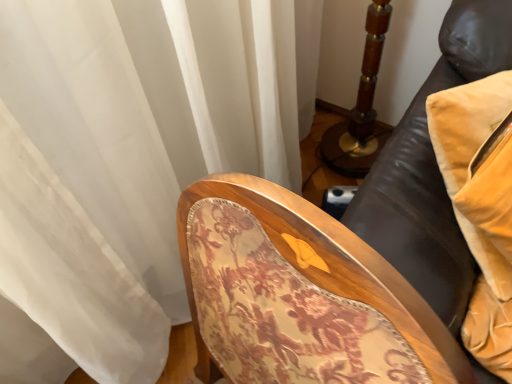
The image size is (512, 384). Describe the element at coordinates (466, 123) in the screenshot. I see `velvet yellow pillow at right` at that location.

You are a GUI agent. You are given a task and a screenshot of the screen. Output one action in this format:
    pyautogui.click(x=<x>, y=<y>)
    Task: Click on the velvet yellow pillow at right
    The image size is (512, 384).
    Given the screenshot: What is the action you would take?
    466,123

Identify the location of floral fabric chair at center. The width and height of the screenshot is (512, 384). (432, 170).

What do you see at coordinates (432, 170) in the screenshot? I see `floral fabric chair at center` at bounding box center [432, 170].

The width and height of the screenshot is (512, 384). Find the location of `velvet yellow pillow at right`. velvet yellow pillow at right is located at coordinates (466, 123).

Which is more to the right, floral fabric chair at center or velvet yellow pillow at right?

velvet yellow pillow at right.

Does floral fabric chair at center lie behind velvet yellow pillow at right?

No, it is in front of velvet yellow pillow at right.

Which is farther, (477,56) or (467,179)?

The point (477,56) is farther.

From the image's perspective, is floral fabric chair at center on top of velvet yellow pillow at right?

No, from the image's perspective, floral fabric chair at center is not over velvet yellow pillow at right.

From a real-world perspective, who is located higher, floral fabric chair at center or velvet yellow pillow at right?

velvet yellow pillow at right.

Between floral fabric chair at center and velvet yellow pillow at right, which one has smaller width?

velvet yellow pillow at right.

Considering the relative sizes of floral fabric chair at center and velvet yellow pillow at right in the image provided, is floral fabric chair at center shorter than velvet yellow pillow at right?

Incorrect, the height of floral fabric chair at center does not fall short of that of velvet yellow pillow at right.

Based on the photo, considering the sizes of floral fabric chair at center and velvet yellow pillow at right in the image, is floral fabric chair at center bigger or smaller than velvet yellow pillow at right?

Considering their sizes, floral fabric chair at center takes up more space than velvet yellow pillow at right.

Is floral fabric chair at center completely or partially outside of velvet yellow pillow at right?

Yes, floral fabric chair at center is outside of velvet yellow pillow at right.

Is floral fabric chair at center touching velvet yellow pillow at right?

No, floral fabric chair at center is not beside velvet yellow pillow at right.

Could you tell me if floral fabric chair at center is turned towards velvet yellow pillow at right?

No, floral fabric chair at center is not facing towards velvet yellow pillow at right.

Where is `pillow above the floral fabric chair at center (from a real-world perspective)`? The image size is (512, 384). pillow above the floral fabric chair at center (from a real-world perspective) is located at coordinates (466, 123).

Considering the positions of objects velvet yellow pillow at right and floral fabric chair at center in the image provided, who is more to the left, velvet yellow pillow at right or floral fabric chair at center?

floral fabric chair at center.

Between velvet yellow pillow at right and floral fabric chair at center, which one is positioned behind?

velvet yellow pillow at right.

Is point (490, 253) in front of point (441, 212)?

Yes, point (490, 253) is closer to viewer.

From the image's perspective, is velvet yellow pillow at right on top of floral fabric chair at center?

Yes, from the image's perspective, velvet yellow pillow at right is on top of floral fabric chair at center.

From a real-world perspective, is velvet yellow pillow at right physically located above or below floral fabric chair at center?

velvet yellow pillow at right is situated higher than floral fabric chair at center in the real world.

Is velvet yellow pillow at right wider than floral fabric chair at center?

Incorrect, the width of velvet yellow pillow at right does not surpass that of floral fabric chair at center.

Considering the relative sizes of velvet yellow pillow at right and floral fabric chair at center in the image provided, is velvet yellow pillow at right taller than floral fabric chair at center?

No.

Looking at the image, does velvet yellow pillow at right seem bigger or smaller compared to floral fabric chair at center?

velvet yellow pillow at right is smaller than floral fabric chair at center.

Is velvet yellow pillow at right outside of floral fabric chair at center?

velvet yellow pillow at right is positioned outside floral fabric chair at center.

Is velvet yellow pillow at right in contact with floral fabric chair at center?

No, velvet yellow pillow at right is not touching floral fabric chair at center.

In the scene shown: Is velvet yellow pillow at right facing towards floral fabric chair at center?

No.

How different are the orientations of velvet yellow pillow at right and floral fabric chair at center in degrees?

velvet yellow pillow at right and floral fabric chair at center are facing 69.2 degrees away from each other.

Based on the photo, how distant is velvet yellow pillow at right from floral fabric chair at center?

velvet yellow pillow at right is 4.58 inches from floral fabric chair at center.

The height and width of the screenshot is (384, 512). Identify the location of pillow behind the floral fabric chair at center. (466, 123).

Image resolution: width=512 pixels, height=384 pixels. What are the coordinates of `pillow above the floral fabric chair at center (from a real-world perspective)` in the screenshot? It's located at (466, 123).

Locate an element on the screen. The width and height of the screenshot is (512, 384). furniture that is below the velvet yellow pillow at right (from the image's perspective) is located at coordinates [432, 170].